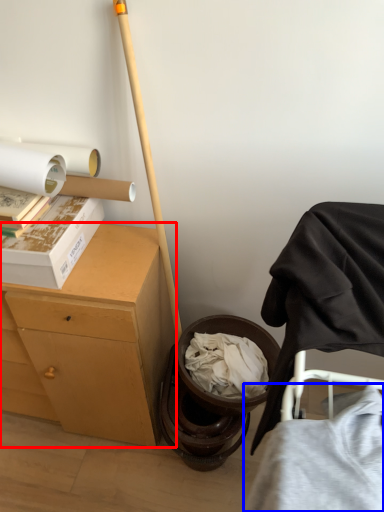
Question: Among these objects, which one is nearest to the camera, desk (highlighted by a red box) or clothing (highlighted by a blue box)?

Choices:
 (A) desk
 (B) clothing

Answer: (B)